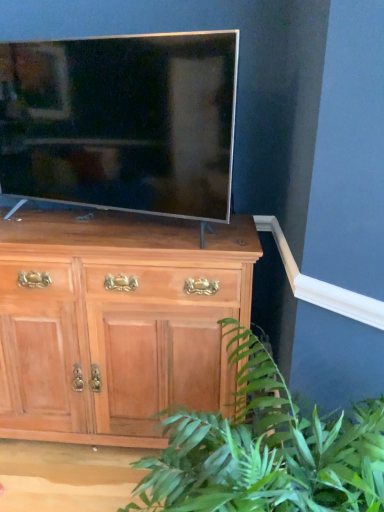
Question: Does light brown wood chest of drawers at center have a lesser height compared to green leafy plant at lower right?

Choices:
 (A) yes
 (B) no

Answer: (B)

Question: From the image's perspective, does light brown wood chest of drawers at center appear lower than green leafy plant at lower right?

Choices:
 (A) yes
 (B) no

Answer: (B)

Question: Is light brown wood chest of drawers at center in front of green leafy plant at lower right?

Choices:
 (A) yes
 (B) no

Answer: (B)

Question: Is light brown wood chest of drawers at center at the right side of green leafy plant at lower right?

Choices:
 (A) no
 (B) yes

Answer: (A)

Question: Is light brown wood chest of drawers at center to the left of green leafy plant at lower right from the viewer's perspective?

Choices:
 (A) yes
 (B) no

Answer: (A)

Question: In terms of height, does green leafy plant at lower right look taller or shorter compared to satin silver tv at center?

Choices:
 (A) tall
 (B) short

Answer: (A)

Question: Considering their positions, is green leafy plant at lower right located in front of or behind satin silver tv at center?

Choices:
 (A) behind
 (B) front

Answer: (B)

Question: From the image's perspective, is green leafy plant at lower right located above or below satin silver tv at center?

Choices:
 (A) below
 (B) above

Answer: (A)

Question: In terms of size, does green leafy plant at lower right appear bigger or smaller than satin silver tv at center?

Choices:
 (A) big
 (B) small

Answer: (A)

Question: In terms of width, does satin silver tv at center look wider or thinner when compared to light brown wood chest of drawers at center?

Choices:
 (A) wide
 (B) thin

Answer: (B)

Question: From the image's perspective, relative to light brown wood chest of drawers at center, is satin silver tv at center above or below?

Choices:
 (A) below
 (B) above

Answer: (B)

Question: Is satin silver tv at center taller or shorter than light brown wood chest of drawers at center?

Choices:
 (A) tall
 (B) short

Answer: (B)

Question: Considering their positions, is satin silver tv at center located in front of or behind light brown wood chest of drawers at center?

Choices:
 (A) front
 (B) behind

Answer: (A)

Question: Is light brown wood chest of drawers at center wider or thinner than satin silver tv at center?

Choices:
 (A) thin
 (B) wide

Answer: (B)

Question: Considering the relative positions of light brown wood chest of drawers at center and satin silver tv at center in the image provided, is light brown wood chest of drawers at center to the left or to the right of satin silver tv at center?

Choices:
 (A) left
 (B) right

Answer: (A)